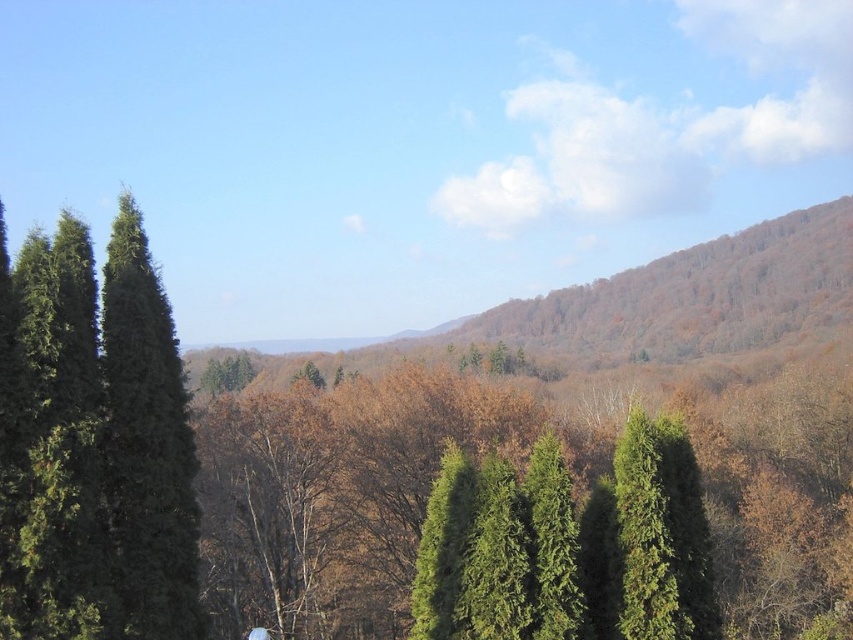
Question: Can you confirm if green textured trees at center is positioned to the right of green matte tree at left?

Choices:
 (A) no
 (B) yes

Answer: (B)

Question: Is green textured trees at center positioned in front of green matte tree at left?

Choices:
 (A) yes
 (B) no

Answer: (B)

Question: Is green textured trees at center above green matte tree at left?

Choices:
 (A) yes
 (B) no

Answer: (B)

Question: Which point is closer to the camera taking this photo?

Choices:
 (A) (747, 500)
 (B) (24, 509)

Answer: (B)